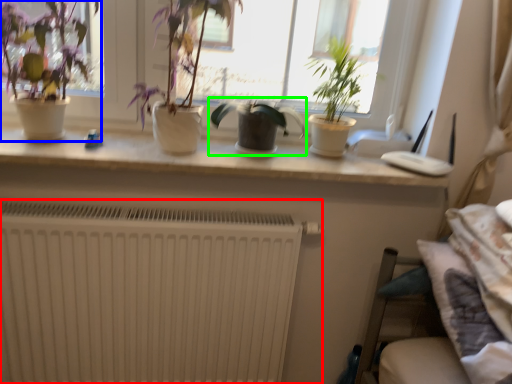
Question: Estimate the real-world distances between objects in this image. Which object is farther from radiator (highlighted by a red box), houseplant (highlighted by a blue box) or houseplant (highlighted by a green box)?

Choices:
 (A) houseplant
 (B) houseplant

Answer: (B)